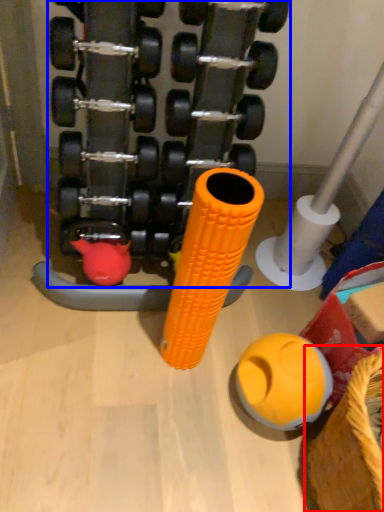
Question: Which object appears farthest to the camera in this image, basket (highlighted by a red box) or dumbbell (highlighted by a blue box)?

Choices:
 (A) basket
 (B) dumbbell

Answer: (A)